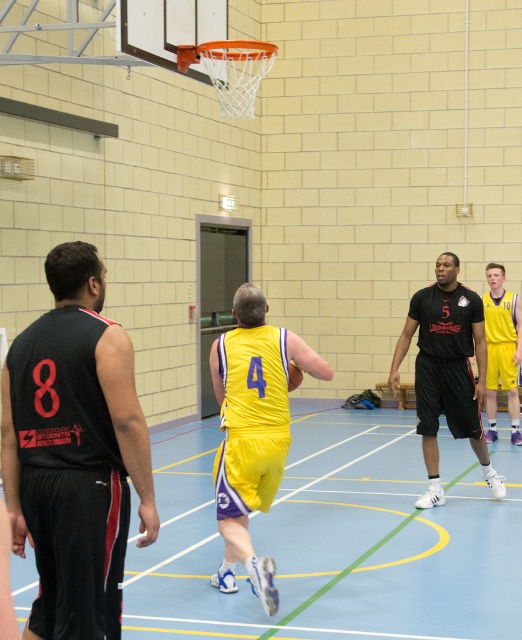
You are a referee observing the basketball game. You notice two players wearing the yellow jersey at center and the black matte basketball jersey at center. Which player is positioned to the left when facing the basketball hoop mounted on the wall?

The yellow jersey at center is to the left of the black matte basketball jersey at center when facing the basketball hoop mounted on the wall.

You are a basketball referee standing at the center of the court. You need to decide if the black mesh jersey at left and the yellow fabric jersey at center are within the 2.44 meters minimum distance required for a legal pick and roll play. Can they proceed with the play?

The distance between the black mesh jersey at left and the yellow fabric jersey at center is 2.42 meters, which is slightly less than the required 2.44 meters. Therefore, they are too close and cannot proceed with the play legally.